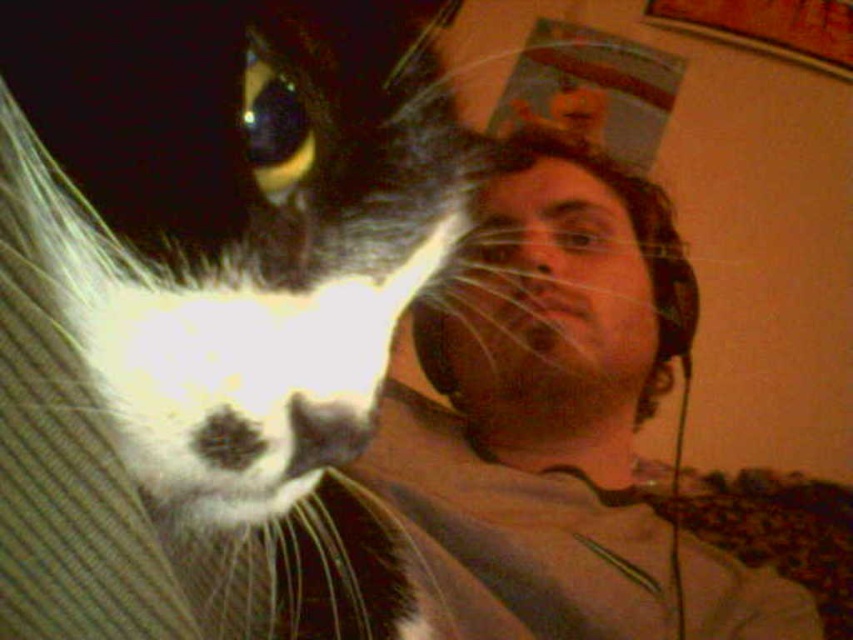
Question: Can you confirm if black and white fur cat at left is thinner than matte black headphones at upper right?

Choices:
 (A) yes
 (B) no

Answer: (A)

Question: Which object is positioned farthest from the matte black headphones at upper right?

Choices:
 (A) matte gray shirt at center
 (B) black and white fur cat at left

Answer: (B)

Question: Where is black and white fur cat at left located in relation to matte black headphones at upper right in the image?

Choices:
 (A) right
 (B) left

Answer: (B)

Question: Does black and white fur cat at left lie behind matte black headphones at upper right?

Choices:
 (A) no
 (B) yes

Answer: (A)

Question: Which point appears closest to the camera in this image?

Choices:
 (A) (430, 349)
 (B) (99, 595)
 (C) (641, 234)

Answer: (B)

Question: Which object appears farthest from the camera in this image?

Choices:
 (A) black and white fur cat at left
 (B) matte gray shirt at center

Answer: (B)